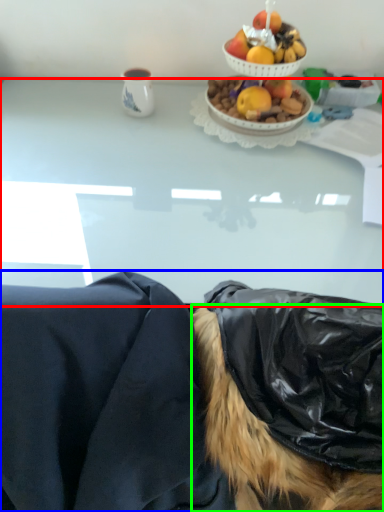
Question: Based on their relative distances, which object is nearer to desk (highlighted by a red box)? Choose from person (highlighted by a blue box) and wig (highlighted by a green box).

Choices:
 (A) person
 (B) wig

Answer: (A)